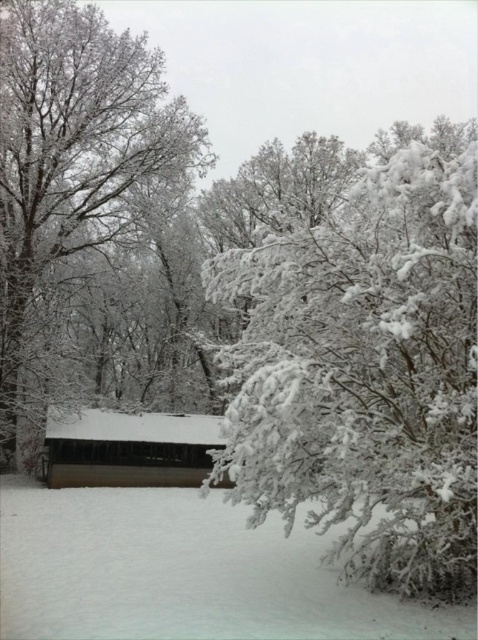
You are a hiker who wants to take shelter from the cold wind. You see the white fluffy snow at lower center and the wooden hut at center. Which location would provide better protection from the wind?

The wooden hut at center would provide better protection from the wind since the white fluffy snow at lower center is positioned under it, likely being sheltered by the structure.

You are planning to build a small garden path between the white frosty tree at center and the wooden hut at center. The path requires a minimum of 30 feet of space. Can you confirm if there is enough space available between them?

The distance between the white frosty tree at center and the wooden hut at center is 37.46 feet, which exceeds the required 30 feet. Therefore, there is sufficient space to build the garden path between them.